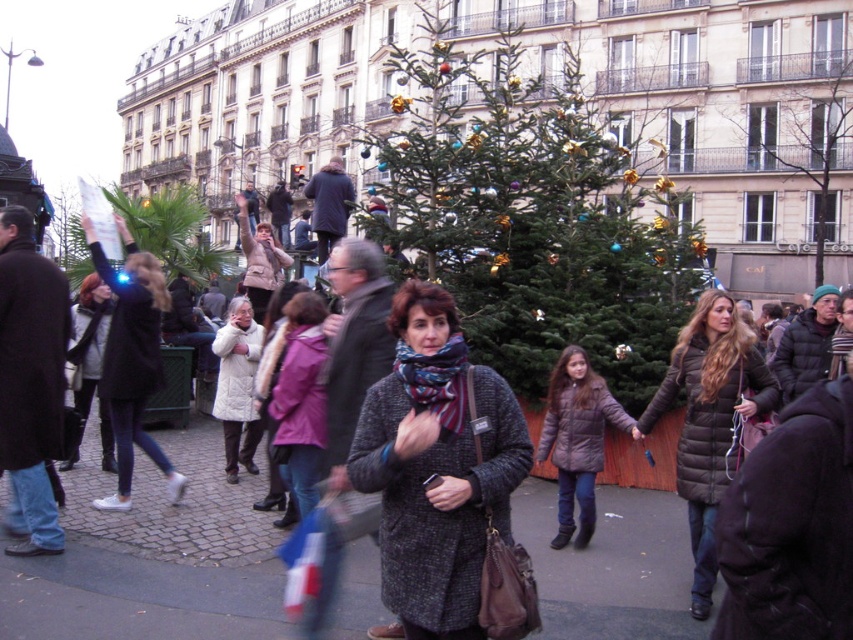
Question: Which point appears farthest from the camera in this image?

Choices:
 (A) (386, 452)
 (B) (605, 419)

Answer: (B)

Question: Which object is positioned closest to the purple fleece jacket at center?

Choices:
 (A) brown puffy coat at right
 (B) knitted wool coat at center

Answer: (B)

Question: Which object is the closest to the green matte christmas tree at upper center?

Choices:
 (A) knitted wool coat at center
 (B) purple fleece jacket at center

Answer: (A)

Question: Is green matte christmas tree at upper center to the right of black matte coat at left from the viewer's perspective?

Choices:
 (A) yes
 (B) no

Answer: (A)

Question: Is green matte christmas tree at center wider than knitted wool coat at center?

Choices:
 (A) no
 (B) yes

Answer: (B)

Question: Is knitted wool coat at center thinner than black matte coat at left?

Choices:
 (A) no
 (B) yes

Answer: (B)